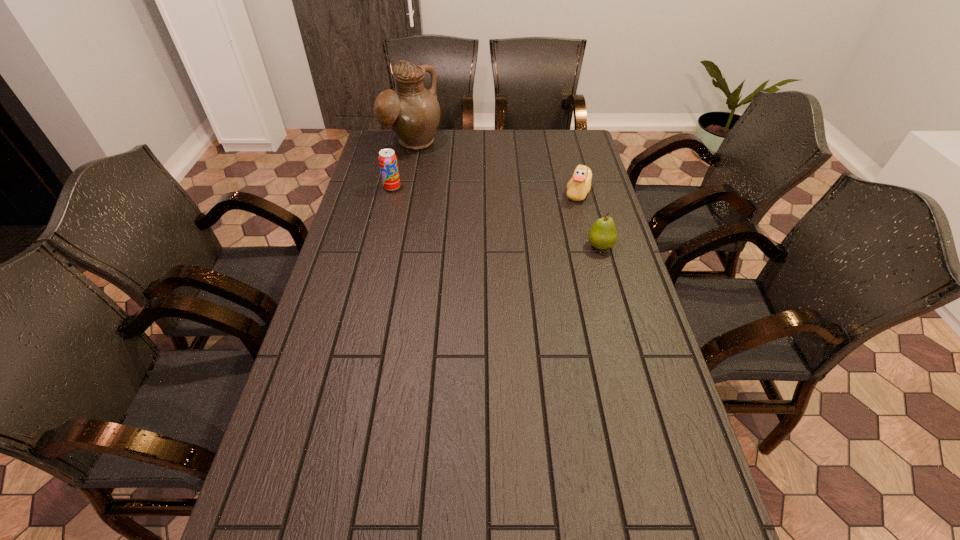
Where is `free point located 0.260m at the spout of the tallest object`? The image size is (960, 540). free point located 0.260m at the spout of the tallest object is located at coordinates (463, 188).

Where is `vacant space located 0.380m at the spout of the tallest object`? This screenshot has width=960, height=540. vacant space located 0.380m at the spout of the tallest object is located at coordinates (482, 205).

Image resolution: width=960 pixels, height=540 pixels. In order to click on vacant area situated at the spout of the tallest object in this screenshot , I will do `click(482, 205)`.

I want to click on object located at the far edge, so click(x=413, y=112).

Locate an element on the screen. soda can that is at the left edge is located at coordinates (388, 163).

Find the location of a particular element. The width and height of the screenshot is (960, 540). pitcher that is at the left edge is located at coordinates (413, 112).

You are a GUI agent. You are given a task and a screenshot of the screen. Output one action in this format:
    pyautogui.click(x=<x>, y=<y>)
    Task: Click on the pear that is at the right edge
    Image resolution: width=960 pixels, height=540 pixels.
    Given the screenshot: What is the action you would take?
    pyautogui.click(x=603, y=235)

Locate an element on the screen. This screenshot has height=540, width=960. duck at the right edge is located at coordinates (579, 185).

Find the location of a particular element. The image size is (960, 540). object located in the far left corner section of the desktop is located at coordinates (413, 112).

The image size is (960, 540). What are the coordinates of `vacant space at the far edge` in the screenshot? It's located at (541, 132).